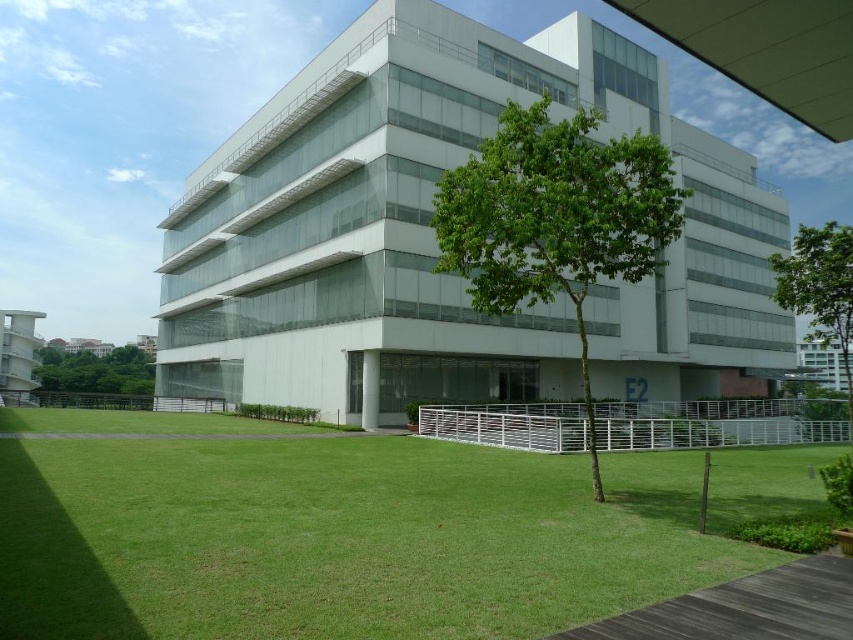
Question: Which is nearer to the green leafy tree at center?

Choices:
 (A) green grass at lower center
 (B) green leafy tree at lower left

Answer: (A)

Question: Is green leafy tree at center to the left of green leafy tree at right from the viewer's perspective?

Choices:
 (A) yes
 (B) no

Answer: (A)

Question: Which of the following is the farthest from the observer?

Choices:
 (A) green leafy tree at right
 (B) green grass at lower center
 (C) green leafy tree at lower left
 (D) green leafy tree at center

Answer: (C)

Question: Is green grass at lower center positioned at the back of green leafy tree at center?

Choices:
 (A) no
 (B) yes

Answer: (A)

Question: Estimate the real-world distances between objects in this image. Which object is farther from the green leafy tree at lower left?

Choices:
 (A) green leafy tree at center
 (B) green grass at lower center
 (C) green leafy tree at right

Answer: (C)

Question: Does green grass at lower center appear on the left side of green leafy tree at lower left?

Choices:
 (A) no
 (B) yes

Answer: (A)